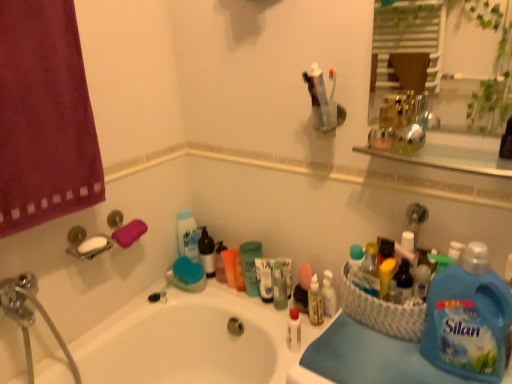
How much space does blue liquid detergent at lower right, the 1th cleaning product viewed from the front, occupy vertically?

It is 12.22 inches.

The image size is (512, 384). What do you see at coordinates (468, 318) in the screenshot?
I see `blue liquid detergent at lower right, placed as the 2th cleaning product when sorted from back to front` at bounding box center [468, 318].

How much space does white glossy bottle at center, marked as the second toiletry in a back-to-front arrangement, occupy vertically?

The height of white glossy bottle at center, marked as the second toiletry in a back-to-front arrangement, is 5.53 inches.

This screenshot has height=384, width=512. Identify the location of translucent plastic bottle at center, which is the second toiletry in front-to-back order. (329, 294).

How much space does translucent plastic bottle at center, which is counted as the first toiletry, starting from the right, occupy horizontally?

It is 3.38 centimeters.

Consider the image. In order to face blue fabric at lower right, should I rotate leftwards or rightwards?

To align with it, rotate right about 14.433°.

Where is `blue liquid detergent at lower right, the 2th cleaning product when ordered from left to right`? The height and width of the screenshot is (384, 512). blue liquid detergent at lower right, the 2th cleaning product when ordered from left to right is located at coordinates (468, 318).

Can you tell me how much translucent plastic bottle at center, which is counted as the first toiletry, starting from the right, and white glossy bottle at center, the second toiletry from the right, differ in facing direction?

The angle between the facing direction of translucent plastic bottle at center, which is counted as the first toiletry, starting from the right, and the facing direction of white glossy bottle at center, the second toiletry from the right, is 56.4 degrees.

Locate an element on the screen. toiletry on the left of translucent plastic bottle at center, which is counted as the first toiletry, starting from the right is located at coordinates (294, 331).

From the image's perspective, is translucent plastic bottle at center, which is the 1th toiletry from back to front, located beneath white glossy bottle at center, the 1th toiletry when ordered from front to back?

Actually, translucent plastic bottle at center, which is the 1th toiletry from back to front, appears above white glossy bottle at center, the 1th toiletry when ordered from front to back, in the image.

From the image's perspective, who appears lower, purple cotton towel at left or white glossy bathtub at center?

white glossy bathtub at center, from the image's perspective.

Is purple cotton towel at left thinner than white glossy bathtub at center?

Yes, purple cotton towel at left is thinner than white glossy bathtub at center.

Is point (3, 122) closer or farther from the camera than point (129, 311)?

Point (3, 122).

Is purple cotton towel at left in front of or behind white glossy bathtub at center in the image?

Clearly, purple cotton towel at left is in front of white glossy bathtub at center.

Which point is more distant from viewer, [226,296] or [336,298]?

The point [226,296] is more distant.

Who is taller, white glossy bathtub at center or translucent plastic bottle at center, which is counted as the first toiletry, starting from the right?

With more height is white glossy bathtub at center.

Could you tell me if white glossy bathtub at center is turned towards translucent plastic bottle at center, which is counted as the 2th toiletry, starting from the left?

No, white glossy bathtub at center is not aimed at translucent plastic bottle at center, which is counted as the 2th toiletry, starting from the left.

Based on the photo, what's the angular difference between white glossy bathtub at center and translucent plastic bottle at center, which is counted as the first toiletry, starting from the right,'s facing directions?

They differ by 90.7 degrees in their facing directions.

Would you say blue fabric at lower right is part of blue liquid detergent at lower right, the 1th cleaning product viewed from the front,'s contents?

That's incorrect, blue fabric at lower right is not inside blue liquid detergent at lower right, the 1th cleaning product viewed from the front.

Does blue liquid detergent at lower right, which is counted as the first cleaning product, starting from the right, come behind blue fabric at lower right?

That is False.

Which is more to the right, blue liquid detergent at lower right, which is counted as the first cleaning product, starting from the right, or blue fabric at lower right?

Positioned to the right is blue liquid detergent at lower right, which is counted as the first cleaning product, starting from the right.

Could you tell me if blue liquid detergent at lower right, the 1th cleaning product viewed from the front, is facing blue fabric at lower right?

No, blue liquid detergent at lower right, the 1th cleaning product viewed from the front, is not oriented towards blue fabric at lower right.

Image resolution: width=512 pixels, height=384 pixels. I want to click on counter top located on the right of white glossy bottle at center, marked as the second toiletry in a back-to-front arrangement, so click(364, 358).

Based on the photo, is blue fabric at lower right wider or thinner than white glossy bottle at center, the 1th toiletry when ordered from left to right?

Considering their sizes, blue fabric at lower right looks broader than white glossy bottle at center, the 1th toiletry when ordered from left to right.

Can you tell me how much blue fabric at lower right and white glossy bottle at center, the second toiletry from the right, differ in facing direction?

28.7 degrees.

From the picture: Does blue fabric at lower right lie behind white glossy bottle at center, the 1th toiletry when ordered from left to right?

No, blue fabric at lower right is in front of white glossy bottle at center, the 1th toiletry when ordered from left to right.

Which is behind, white glossy bathtub at center or white glossy bottle at center, marked as the second toiletry in a back-to-front arrangement?

white glossy bottle at center, marked as the second toiletry in a back-to-front arrangement, is further from the camera.

Considering the sizes of objects white glossy bathtub at center and white glossy bottle at center, the 1th toiletry when ordered from left to right, in the image provided, who is smaller, white glossy bathtub at center or white glossy bottle at center, the 1th toiletry when ordered from left to right,?

Smaller between the two is white glossy bottle at center, the 1th toiletry when ordered from left to right.

From the image's perspective, is white glossy bathtub at center over white glossy bottle at center, marked as the second toiletry in a back-to-front arrangement?

Actually, white glossy bathtub at center appears below white glossy bottle at center, marked as the second toiletry in a back-to-front arrangement, in the image.

What's the angular difference between white glossy bathtub at center and white glossy bottle at center, the 1th toiletry when ordered from left to right,'s facing directions?

147 degrees.

Is point (300, 329) more distant than point (184, 363)?

No.

Looking at this image, from the image's perspective, which is below, white glossy bottle at center, the 1th toiletry when ordered from left to right, or white glossy bathtub at center?

white glossy bathtub at center.

Considering the relative positions of white glossy bottle at center, the second toiletry from the right, and white glossy bathtub at center in the image provided, is white glossy bottle at center, the second toiletry from the right, to the right of white glossy bathtub at center from the viewer's perspective?

Yes, white glossy bottle at center, the second toiletry from the right, is to the right of white glossy bathtub at center.

Based on the photo, considering the sizes of white glossy bottle at center, the 1th toiletry when ordered from left to right, and white glossy bathtub at center in the image, is white glossy bottle at center, the 1th toiletry when ordered from left to right, taller or shorter than white glossy bathtub at center?

Clearly, white glossy bottle at center, the 1th toiletry when ordered from left to right, is shorter compared to white glossy bathtub at center.

At what (x,y) coordinates should I click in order to perform the action: click on toiletry below the translucent plastic bottle at center, which is counted as the first toiletry, starting from the right (from a real-world perspective). Please return your answer as a coordinate pair (x, y). The image size is (512, 384). Looking at the image, I should click on (294, 331).

The image size is (512, 384). I want to click on shower curtain that appears above the white glossy bathtub at center (from the image's perspective), so 44,117.

Considering their positions, is blue fabric at lower right positioned closer to translucent plastic cup at center, the 2th cleaning product in the front-to-back sequence, than white glossy bottle at center, the 1th toiletry when ordered from front to back?

Among the two, white glossy bottle at center, the 1th toiletry when ordered from front to back, is located nearer to translucent plastic cup at center, the 2th cleaning product in the front-to-back sequence.

When comparing their distances from white glossy bathtub at center, does translucent plastic bottle at center, which is counted as the first toiletry, starting from the right, or blue liquid detergent at lower right, the 2th cleaning product when ordered from left to right, seem further?

blue liquid detergent at lower right, the 2th cleaning product when ordered from left to right.

From the image, which object appears to be nearer to white glossy bathtub at center, translucent plastic cup at center, marked as the first cleaning product in a left-to-right arrangement, or blue fabric at lower right?

translucent plastic cup at center, marked as the first cleaning product in a left-to-right arrangement, is closer to white glossy bathtub at center.

From the image, which object appears to be farther from blue fabric at lower right, translucent plastic cup at center, the 2th cleaning product from the right, or white glossy bottle at center, the 1th toiletry when ordered from left to right?

Among the two, translucent plastic cup at center, the 2th cleaning product from the right, is located further to blue fabric at lower right.

When comparing their distances from translucent plastic cup at center, marked as the first cleaning product in a left-to-right arrangement, does white glossy bottle at center, the second toiletry from the right, or purple cotton towel at left seem closer?

The object closer to translucent plastic cup at center, marked as the first cleaning product in a left-to-right arrangement, is white glossy bottle at center, the second toiletry from the right.

Based on their spatial positions, is blue fabric at lower right or white glossy bathtub at center further from blue liquid detergent at lower right, the 1th cleaning product viewed from the front?

Based on the image, white glossy bathtub at center appears to be further to blue liquid detergent at lower right, the 1th cleaning product viewed from the front.

Considering their positions, is white glossy bathtub at center positioned further to translucent plastic bottle at center, which is counted as the first toiletry, starting from the right, than white glossy bottle at center, marked as the second toiletry in a back-to-front arrangement?

white glossy bathtub at center is positioned further to the anchor translucent plastic bottle at center, which is counted as the first toiletry, starting from the right.

From the image, which object appears to be farther from blue liquid detergent at lower right, placed as the 2th cleaning product when sorted from back to front, translucent plastic bottle at center, which is the second toiletry in front-to-back order, or translucent plastic cup at center, the 2th cleaning product in the front-to-back sequence?

Based on the image, translucent plastic cup at center, the 2th cleaning product in the front-to-back sequence, appears to be further to blue liquid detergent at lower right, placed as the 2th cleaning product when sorted from back to front.

At what (x,y) coordinates should I click in order to perform the action: click on cleaning product located between purple cotton towel at left and translucent plastic bottle at center, which is the 1th toiletry from back to front, in the left-right direction. Please return your answer as a coordinate pair (x, y). Looking at the image, I should click on (250, 266).

Where is `counter top located between blue liquid detergent at lower right, the 1th cleaning product viewed from the front, and white glossy bottle at center, the 1th toiletry when ordered from left to right, in the depth direction`? Image resolution: width=512 pixels, height=384 pixels. counter top located between blue liquid detergent at lower right, the 1th cleaning product viewed from the front, and white glossy bottle at center, the 1th toiletry when ordered from left to right, in the depth direction is located at coordinates (364, 358).

Locate an element on the screen. This screenshot has height=384, width=512. counter top between purple cotton towel at left and blue liquid detergent at lower right, the 2th cleaning product when ordered from left to right is located at coordinates (364, 358).

Where is `toiletry between purple cotton towel at left and translucent plastic bottle at center, which is the second toiletry in front-to-back order, in the horizontal direction`? The image size is (512, 384). toiletry between purple cotton towel at left and translucent plastic bottle at center, which is the second toiletry in front-to-back order, in the horizontal direction is located at coordinates (294, 331).